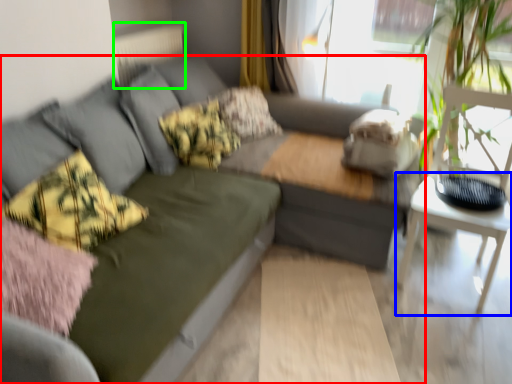
Question: Which object is positioned farthest from studio couch (highlighted by a red box)? Select from table (highlighted by a blue box) and radiator (highlighted by a green box).

Choices:
 (A) table
 (B) radiator

Answer: (B)